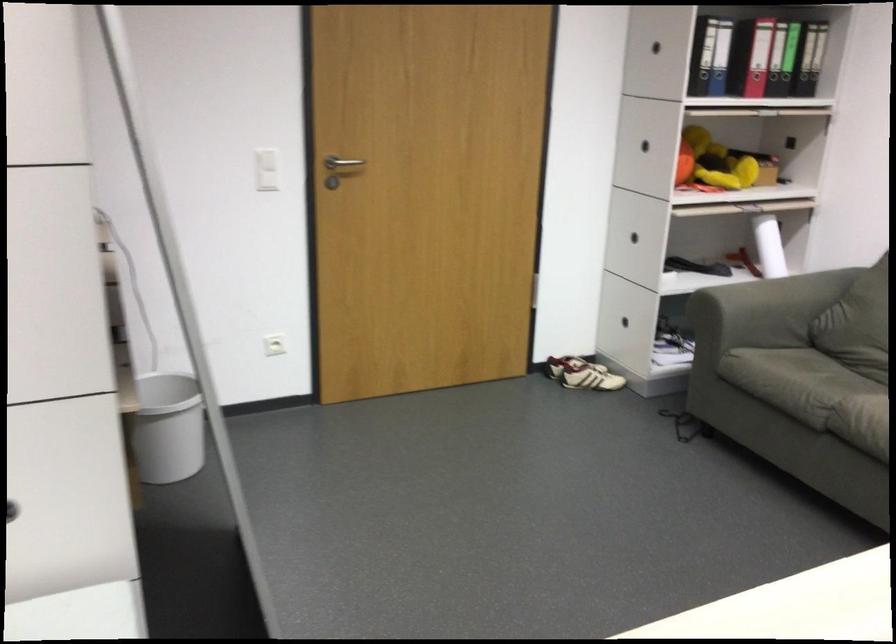
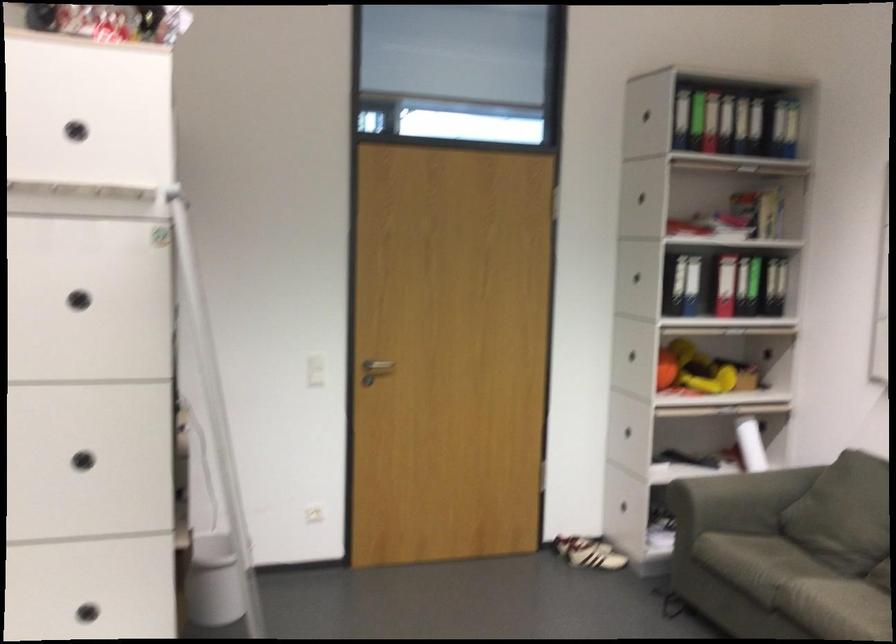
In the second image, find the point that corresponds to (341,172) in the first image.

(374, 370)